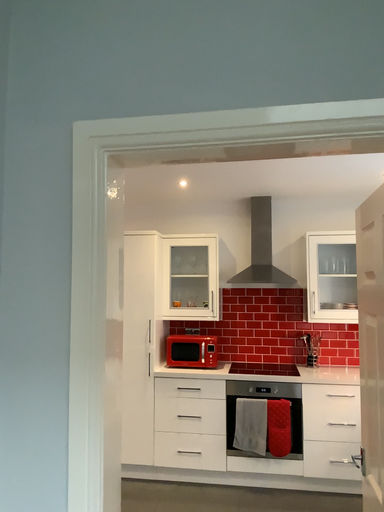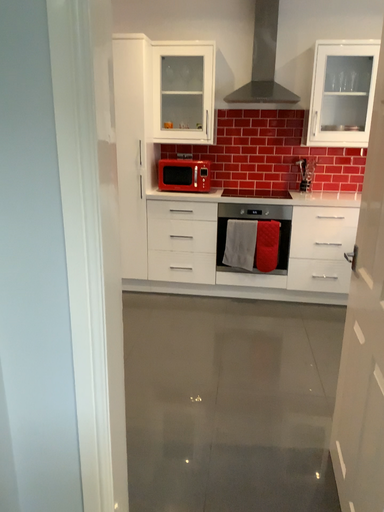
Question: How did the camera likely rotate when shooting the video?

Choices:
 (A) rotated downward
 (B) rotated upward

Answer: (A)